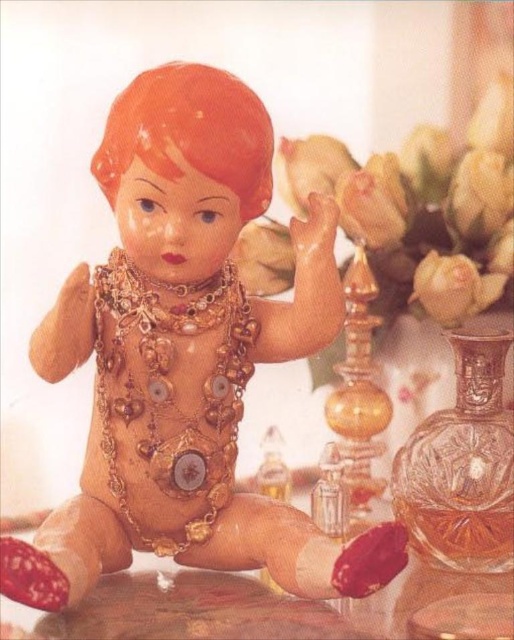
You are a photographer setting up a shoot. You have a matte gold doll at center and a smooth wooden table at center in your scene. To ensure proper lighting, you need to know which object is closer to the camera. Can you determine which one is positioned higher in the frame?

The matte gold doll at center is above the smooth wooden table at center, so it is positioned higher in the frame and closer to the camera.

You are a collector who wants to display the matte gold doll at center on the smooth wooden table at center. Based on the scene description, will the doll fit on the table without hanging over the edges?

The matte gold doll at center is much taller than the smooth wooden table at center, so it may not fit properly on the table without hanging over the edges.